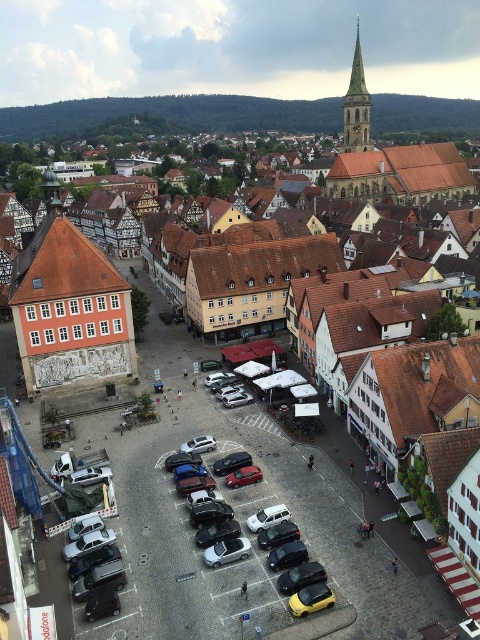
You are a delivery driver who needs to park a truck that is 2.5 meters wide in the town square. You see the metallic yellow car at center and the white matte van at center. Which parking space between these two vehicles can accommodate your truck?

The metallic yellow car at center has a larger width than the white matte van at center. Therefore, the parking space next to the metallic yellow car at center is wider and can accommodate the truck.

You are a delivery driver trying to park in the town square. You have a white matte van at center and a metallic silver car at center. Which vehicle will require a wider parking space?

The metallic silver car at center requires a wider parking space because its width is greater than the white matte van at center.